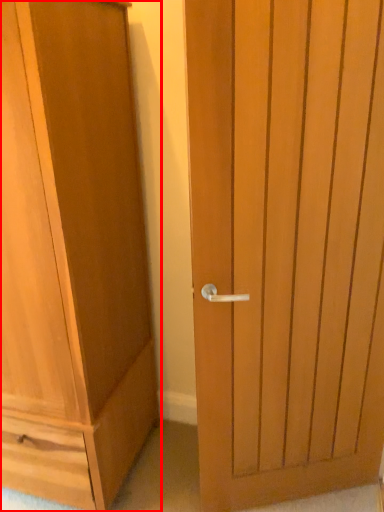
Question: From the image's perspective, considering the relative positions of cupboard (annotated by the red box) and door in the image provided, where is cupboard (annotated by the red box) located with respect to the staircase?

Choices:
 (A) below
 (B) above

Answer: (B)